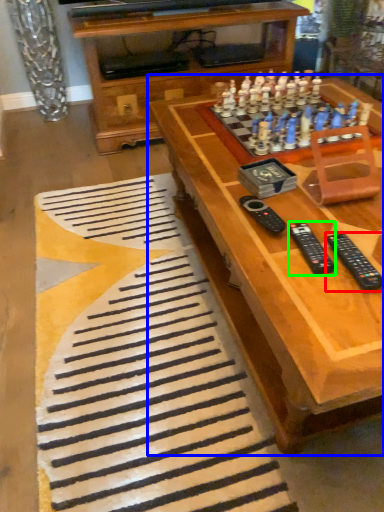
Question: Estimate the real-world distances between objects in this image. Which object is farther from remote (highlighted by a red box), table (highlighted by a blue box) or remote (highlighted by a green box)?

Choices:
 (A) table
 (B) remote

Answer: (A)